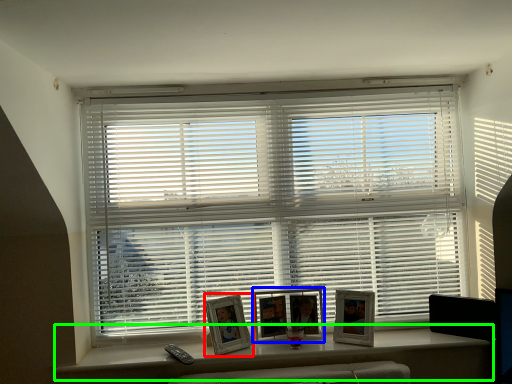
Question: Considering the real-world distances, which object is farthest from picture frame (highlighted by a red box)? picture frame (highlighted by a blue box) or window (highlighted by a green box)?

Choices:
 (A) picture frame
 (B) window

Answer: (B)